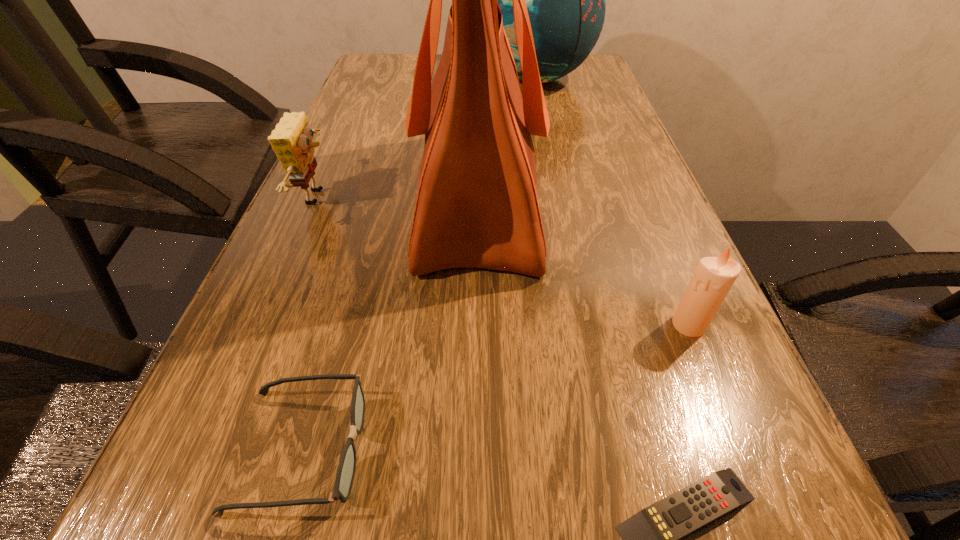
Identify the location of vacant space situated 0.260m on the back of the candle. (641, 212).

Identify the location of vacant space located 0.210m on the face of the spectacles. coord(530,449).

Find the location of a particular element. The width and height of the screenshot is (960, 540). object that is positioned at the far edge is located at coordinates (566, 0).

You are a GUI agent. You are given a task and a screenshot of the screen. Output one action in this format:
    pyautogui.click(x=<x>, y=<y>)
    Task: Click on the sponge located at the left edge
    The image size is (960, 540).
    Given the screenshot: What is the action you would take?
    pyautogui.click(x=291, y=140)

Locate an element on the screen. This screenshot has width=960, height=540. spectacles present at the left edge is located at coordinates (345, 473).

Identify the location of globe situated at the right edge. This screenshot has height=540, width=960. click(566, 0).

Locate an element on the screen. Image resolution: width=960 pixels, height=540 pixels. candle situated at the right edge is located at coordinates (713, 278).

Where is `object that is at the far right corner`? The width and height of the screenshot is (960, 540). object that is at the far right corner is located at coordinates (566, 0).

Locate an element on the screen. vacant space at the left edge of the desktop is located at coordinates (229, 358).

Where is `vacant space at the right edge of the desktop`? vacant space at the right edge of the desktop is located at coordinates (668, 214).